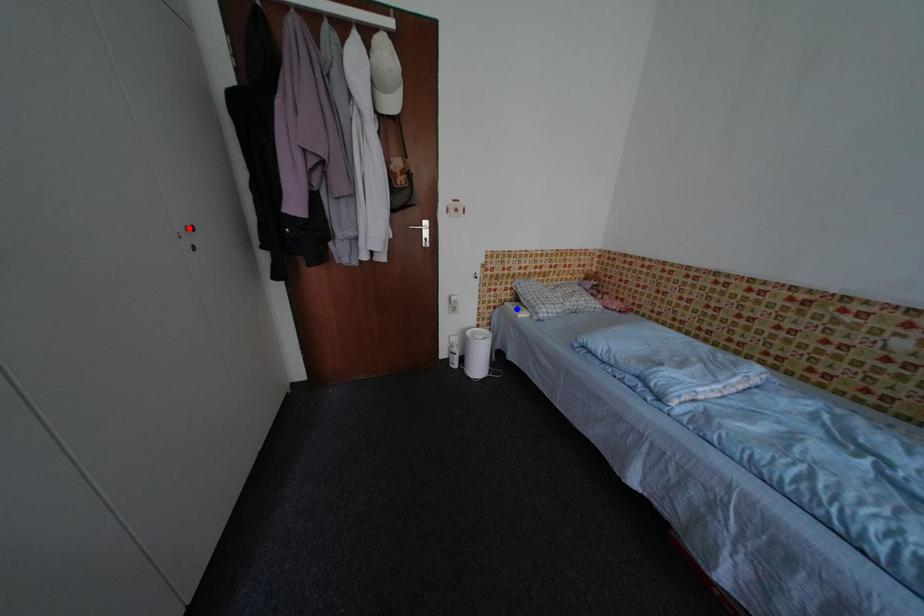
Question: In the image, two points are highlighted. Which point is nearer to the camera? Reply with the corresponding letter.

Choices:
 (A) blue point
 (B) red point

Answer: (B)